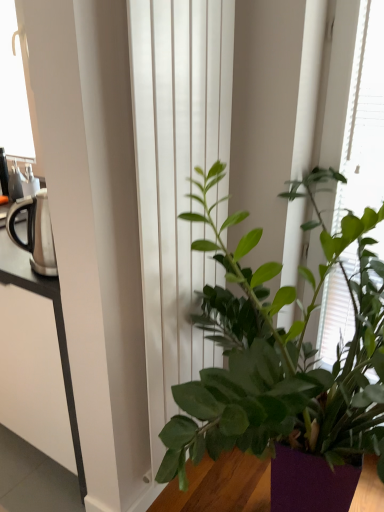
Question: Is green leafy plant at center to the left of green matte plant at center from the viewer's perspective?

Choices:
 (A) no
 (B) yes

Answer: (A)

Question: Is green leafy plant at center closer to camera compared to green matte plant at center?

Choices:
 (A) no
 (B) yes

Answer: (A)

Question: From a real-world perspective, is green leafy plant at center on top of green matte plant at center?

Choices:
 (A) yes
 (B) no

Answer: (A)

Question: Does green leafy plant at center have a lesser width compared to green matte plant at center?

Choices:
 (A) yes
 (B) no

Answer: (A)

Question: Is green leafy plant at center further to the viewer compared to green matte plant at center?

Choices:
 (A) yes
 (B) no

Answer: (A)

Question: From a real-world perspective, is green leafy plant at center beneath green matte plant at center?

Choices:
 (A) no
 (B) yes

Answer: (A)

Question: From a real-world perspective, is white smooth curtain at center positioned under silver metallic kettle at left based on gravity?

Choices:
 (A) no
 (B) yes

Answer: (B)

Question: Is white smooth curtain at center at the left side of silver metallic kettle at left?

Choices:
 (A) no
 (B) yes

Answer: (A)

Question: Does white smooth curtain at center turn towards silver metallic kettle at left?

Choices:
 (A) no
 (B) yes

Answer: (A)

Question: Does white smooth curtain at center have a larger size compared to silver metallic kettle at left?

Choices:
 (A) yes
 (B) no

Answer: (A)

Question: Can you confirm if white smooth curtain at center is wider than silver metallic kettle at left?

Choices:
 (A) no
 (B) yes

Answer: (A)

Question: Can you confirm if white smooth curtain at center is thinner than silver metallic kettle at left?

Choices:
 (A) no
 (B) yes

Answer: (B)

Question: Is white smooth curtain at center located outside green leafy plant at center?

Choices:
 (A) yes
 (B) no

Answer: (A)